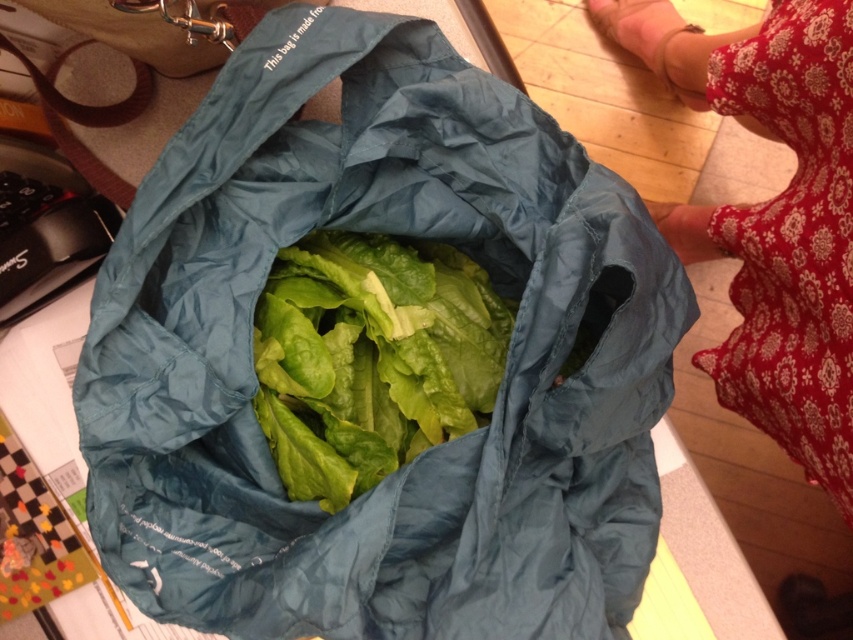
Consider the image. Who is more forward, (x=788, y=435) or (x=270, y=435)?

Point (x=270, y=435) is more forward.

At what (x,y) coordinates should I click in order to perform the action: click on red floral dress at lower right. Please return your answer as a coordinate pair (x, y). The image size is (853, 640). Looking at the image, I should click on (772, 216).

Measure the distance from teal fabric bag at center to red floral dress at lower right.

16.86 inches

Is point (256, 616) closer to viewer compared to point (642, 13)?

That is True.

Is point (112, 467) positioned before point (848, 28)?

Yes.

I want to click on teal fabric bag at center, so click(427, 449).

Which is below, teal fabric bag at center or green leafy lettuce at center?

green leafy lettuce at center is lower down.

Consider the image. Does teal fabric bag at center have a smaller size compared to green leafy lettuce at center?

No, teal fabric bag at center is not smaller than green leafy lettuce at center.

Is point (258, 148) closer to viewer compared to point (364, 448)?

Yes.

What are the coordinates of `teal fabric bag at center` in the screenshot? It's located at (427, 449).